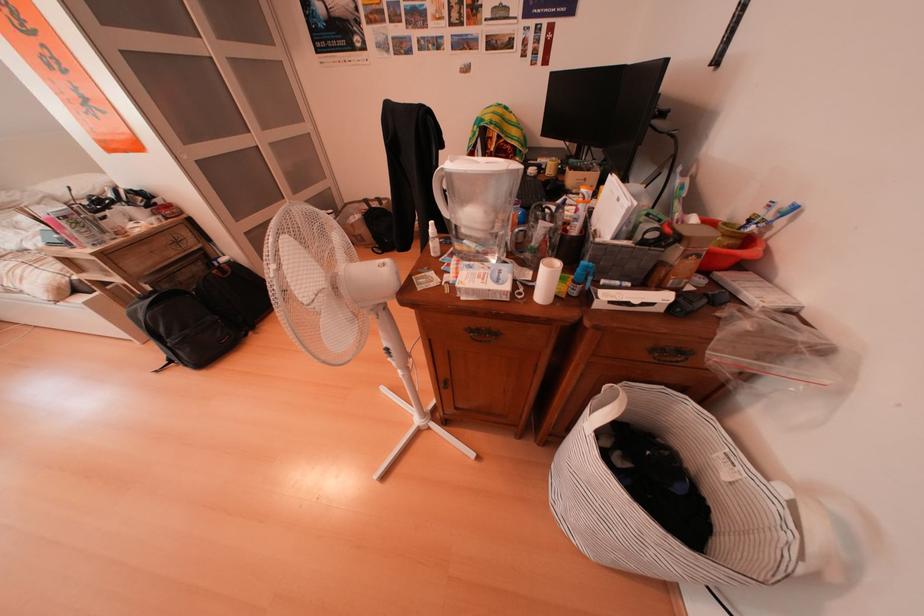
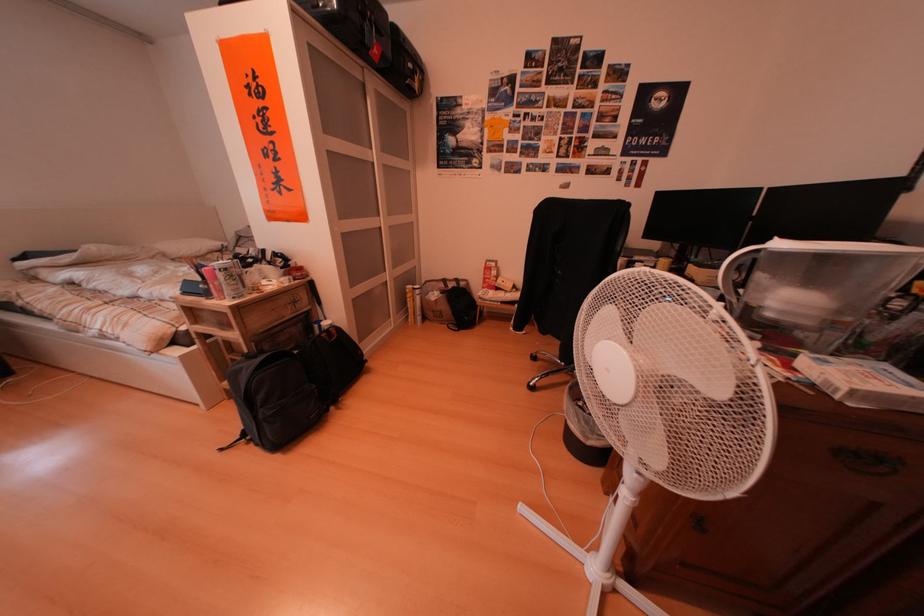
Question: Which direction would the cameraman need to move to produce the second image? Reply with the corresponding letter.

Choices:
 (A) Left
 (B) Right
 (C) Forward
 (D) Backward

Answer: (A)